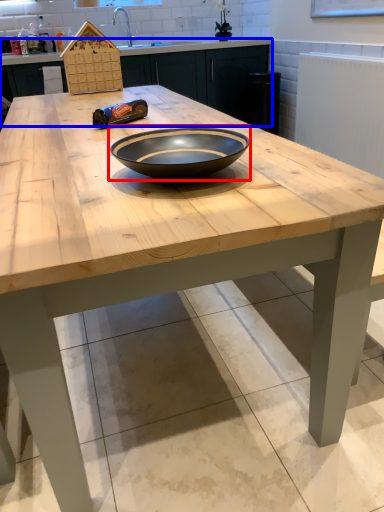
Question: Which object appears closest to the camera in this image, bowl (highlighted by a red box) or cabinetry (highlighted by a blue box)?

Choices:
 (A) bowl
 (B) cabinetry

Answer: (A)